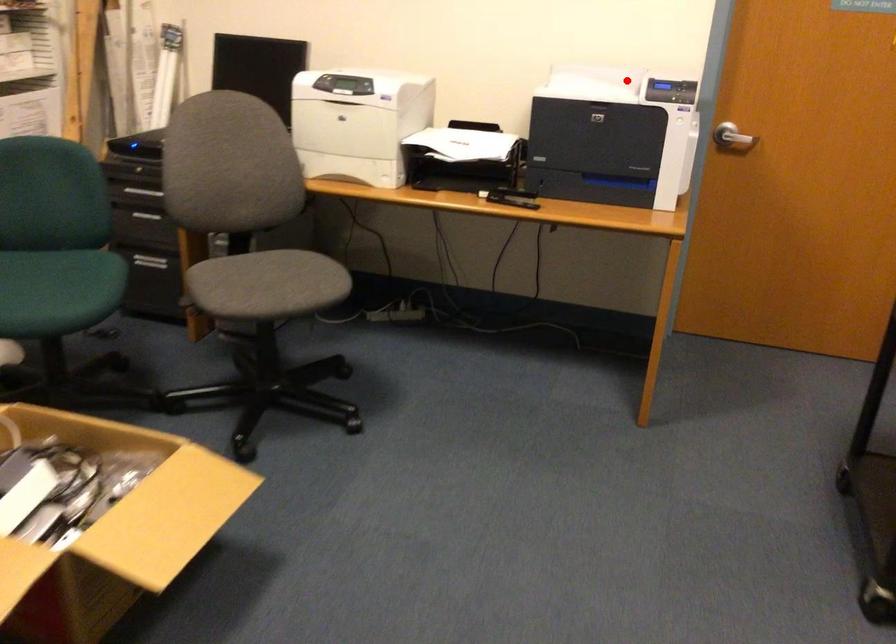
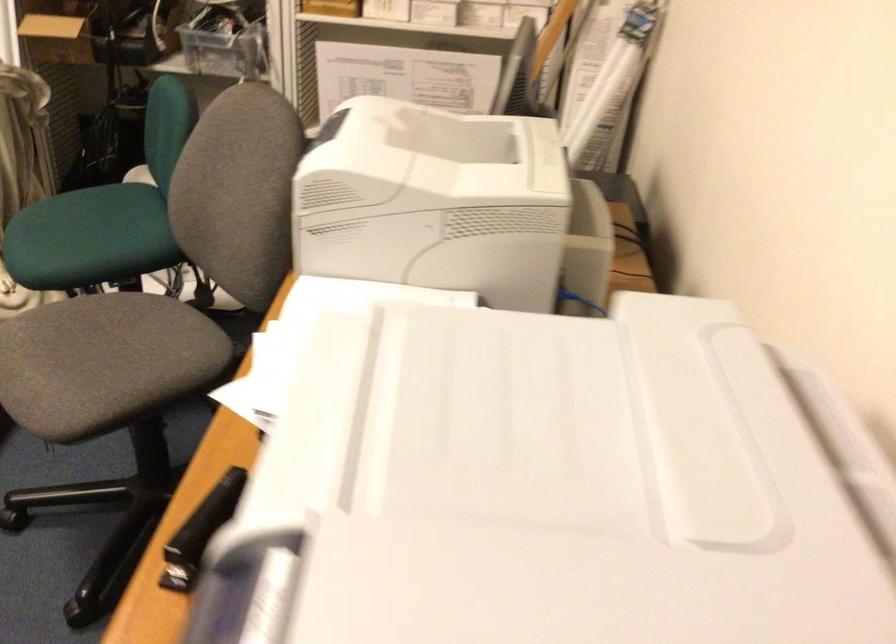
Question: A red point is marked in image1. In image2, is the corresponding 3D point closer to the camera or farther? Reply with the corresponding letter.

Choices:
 (A) The corresponding 3D point is closer.
 (B) The corresponding 3D point is farther.

Answer: (A)